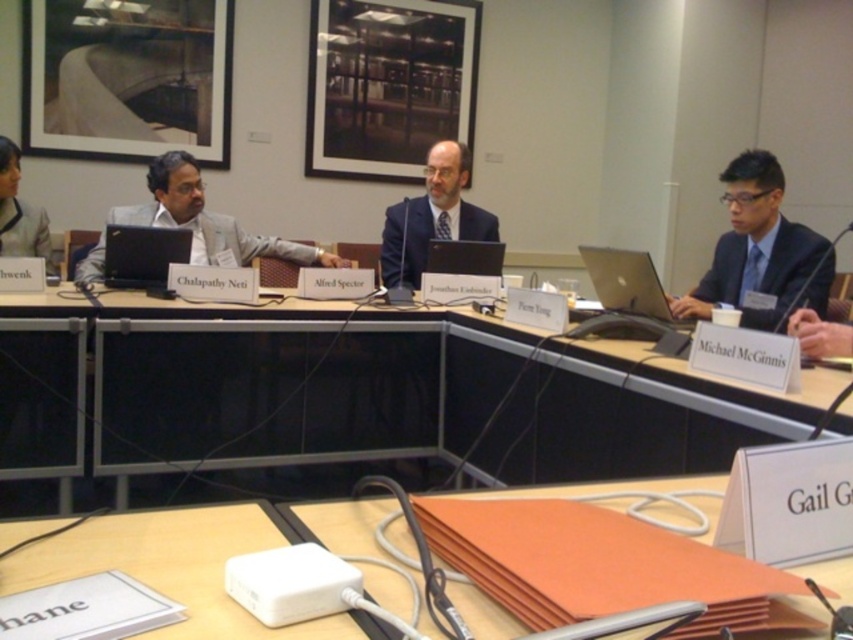
Can you confirm if matte black picture frame at upper left is positioned to the right of black glossy laptop at center?

No, matte black picture frame at upper left is not to the right of black glossy laptop at center.

Who is taller, matte black picture frame at upper left or black glossy laptop at center?

With more height is matte black picture frame at upper left.

Measure the distance between matte black picture frame at upper left and camera.

matte black picture frame at upper left is 14.19 feet away from camera.

You are a GUI agent. You are given a task and a screenshot of the screen. Output one action in this format:
    pyautogui.click(x=<x>, y=<y>)
    Task: Click on the matte black picture frame at upper left
    This screenshot has width=853, height=640.
    Given the screenshot: What is the action you would take?
    pyautogui.click(x=126, y=77)

Which of these two, matte black picture frame at upper left or dark blue suit at right, stands taller?

matte black picture frame at upper left

Is matte black picture frame at upper left below dark blue suit at right?

No, matte black picture frame at upper left is not below dark blue suit at right.

Measure the distance between matte black picture frame at upper left and camera.

4.33 meters

Where is `matte black picture frame at upper left`? Image resolution: width=853 pixels, height=640 pixels. matte black picture frame at upper left is located at coordinates (126, 77).

Between orange paper at lower center and light gray suit at center, which one has more height?

light gray suit at center is taller.

Who is lower down, orange paper at lower center or light gray suit at center?

orange paper at lower center is lower down.

Image resolution: width=853 pixels, height=640 pixels. Identify the location of orange paper at lower center. (171, 566).